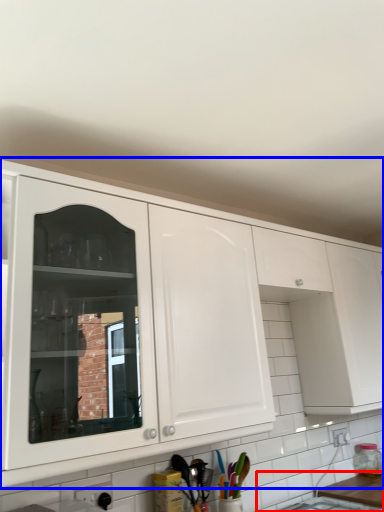
Question: Which point is further to the camera, counter top (highlighted by a red box) or cabinetry (highlighted by a blue box)?

Choices:
 (A) counter top
 (B) cabinetry

Answer: (A)